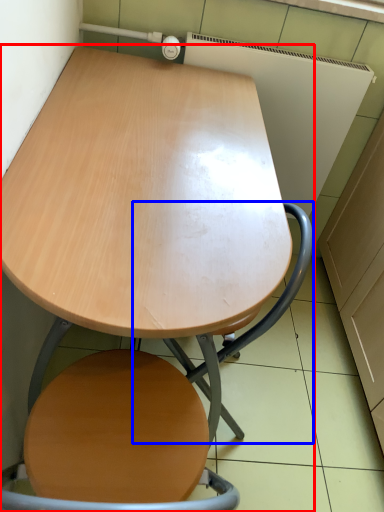
Question: Among these objects, which one is farthest to the camera, table (highlighted by a red box) or swivel chair (highlighted by a blue box)?

Choices:
 (A) table
 (B) swivel chair

Answer: (B)